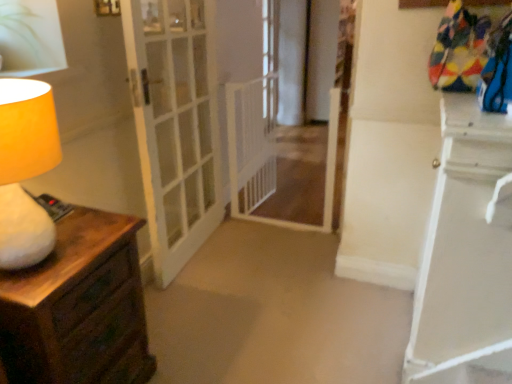
Question: From the image's perspective, is white mesh gate at center below matte yellow lampshade at left?

Choices:
 (A) yes
 (B) no

Answer: (B)

Question: Does white mesh gate at center have a lesser width compared to matte yellow lampshade at left?

Choices:
 (A) yes
 (B) no

Answer: (B)

Question: Is white mesh gate at center completely or partially outside of matte yellow lampshade at left?

Choices:
 (A) yes
 (B) no

Answer: (A)

Question: Is white mesh gate at center taller than matte yellow lampshade at left?

Choices:
 (A) no
 (B) yes

Answer: (B)

Question: From a real-world perspective, is white mesh gate at center positioned over matte yellow lampshade at left based on gravity?

Choices:
 (A) yes
 (B) no

Answer: (B)

Question: Looking at their shapes, would you say green leafy plant at upper left is wider or thinner than clear glass window at center?

Choices:
 (A) wide
 (B) thin

Answer: (A)

Question: Is green leafy plant at upper left inside the boundaries of clear glass window at center, or outside?

Choices:
 (A) outside
 (B) inside

Answer: (A)

Question: In terms of height, does green leafy plant at upper left look taller or shorter compared to clear glass window at center?

Choices:
 (A) short
 (B) tall

Answer: (A)

Question: Is green leafy plant at upper left bigger or smaller than clear glass window at center?

Choices:
 (A) big
 (B) small

Answer: (B)

Question: Relative to white glass door at center, is green leafy plant at upper left in front or behind?

Choices:
 (A) behind
 (B) front

Answer: (B)

Question: From a real-world perspective, is green leafy plant at upper left positioned above or below white glass door at center?

Choices:
 (A) above
 (B) below

Answer: (A)

Question: From the image's perspective, is green leafy plant at upper left located above or below white glass door at center?

Choices:
 (A) below
 (B) above

Answer: (B)

Question: Does point (53, 31) appear closer or farther from the camera than point (199, 100)?

Choices:
 (A) closer
 (B) farther

Answer: (A)

Question: Is point (267, 41) closer or farther from the camera than point (33, 276)?

Choices:
 (A) closer
 (B) farther

Answer: (B)

Question: Considering the positions of clear glass window at center and wooden chest of drawers at left in the image, is clear glass window at center wider or thinner than wooden chest of drawers at left?

Choices:
 (A) wide
 (B) thin

Answer: (B)